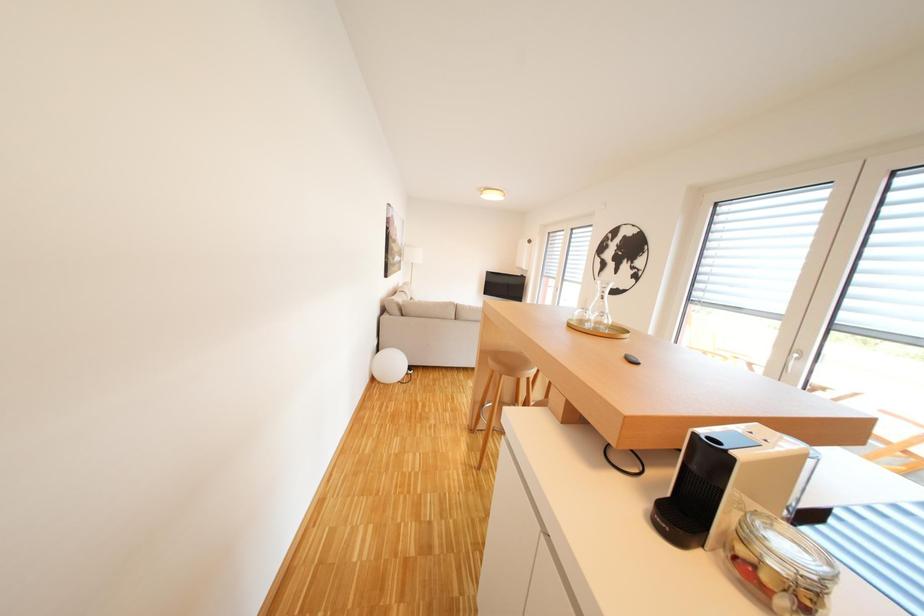
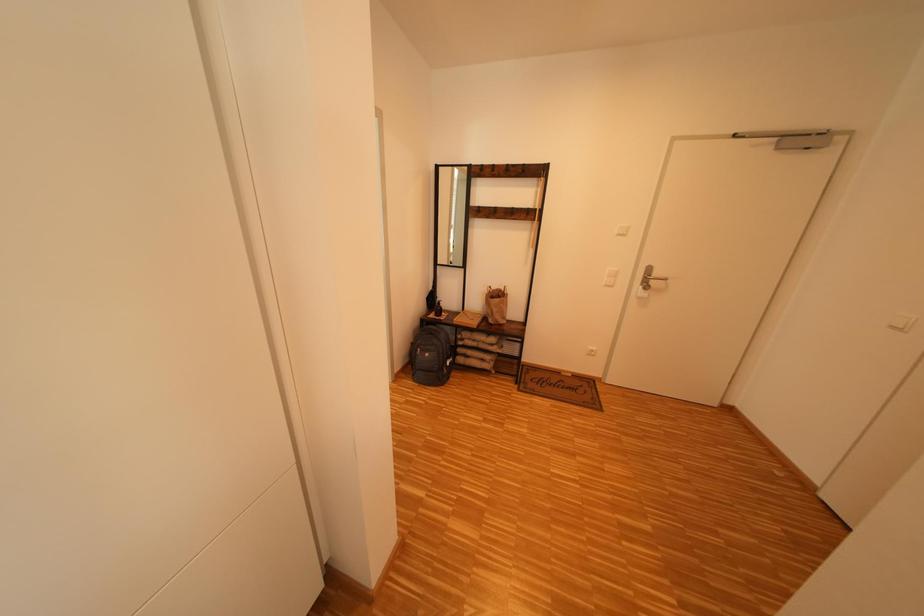
How did the camera likely rotate?

The rotation direction of the camera is left-down.